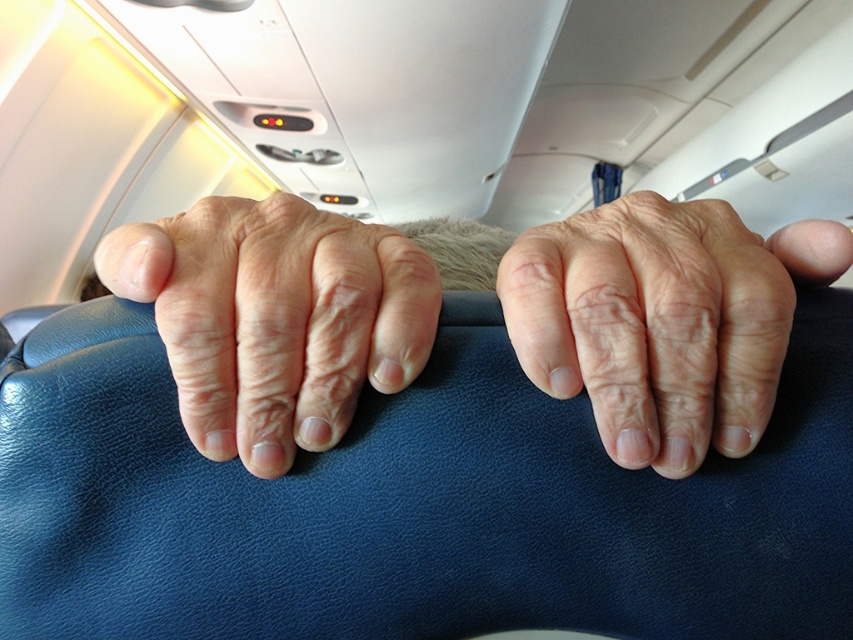
You are a flight attendant checking the safety of the airplane seats. You notice the dry skin at center between two hands gripping the armrest. How far apart are the two hands gripping the armrest?

The two hands gripping the armrest are 9.49 inches apart.